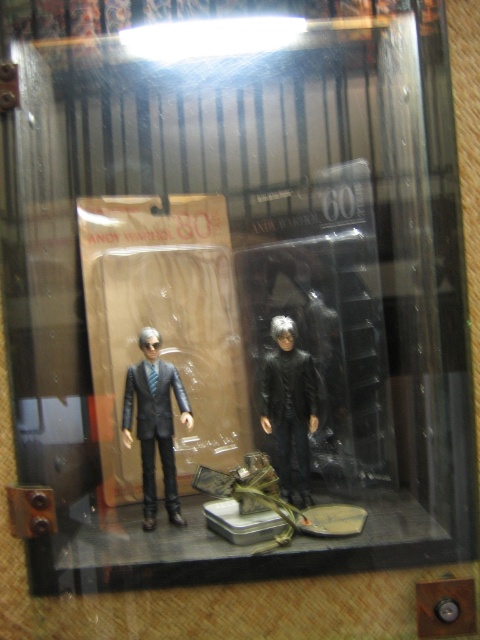
Question: From the image, what is the correct spatial relationship of matte black suit at center in relation to black matte figure at center?

Choices:
 (A) above
 (B) below

Answer: (B)

Question: Which of the following is the closest to the observer?

Choices:
 (A) black matte figure at center
 (B) matte black suit at center

Answer: (B)

Question: Which point is farther to the camera?

Choices:
 (A) black matte figure at center
 (B) matte black suit at center

Answer: (A)

Question: Does matte black suit at center appear on the right side of black matte figure at center?

Choices:
 (A) no
 (B) yes

Answer: (A)

Question: Does matte black suit at center have a greater width compared to black matte figure at center?

Choices:
 (A) no
 (B) yes

Answer: (B)